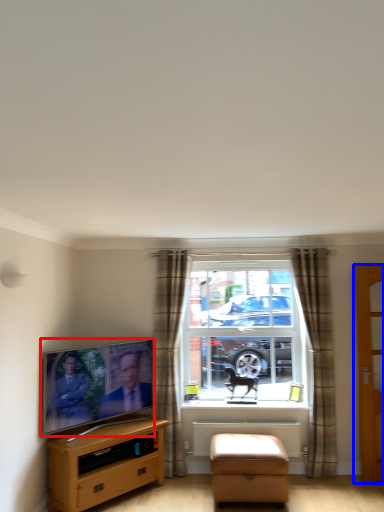
Question: Which of the following is the farthest to the observer, television (highlighted by a red box) or door (highlighted by a blue box)?

Choices:
 (A) television
 (B) door

Answer: (B)